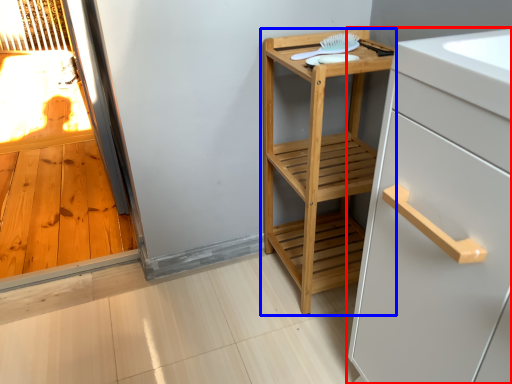
Question: Which object appears closest to the camera in this image, cabinetry (highlighted by a red box) or furniture (highlighted by a blue box)?

Choices:
 (A) cabinetry
 (B) furniture

Answer: (A)